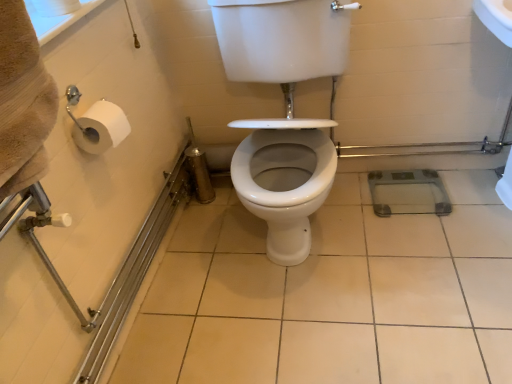
Locate an element on the screen. The height and width of the screenshot is (384, 512). vacant area that is situated to the right of white glossy toilet seat at center is located at coordinates (415, 247).